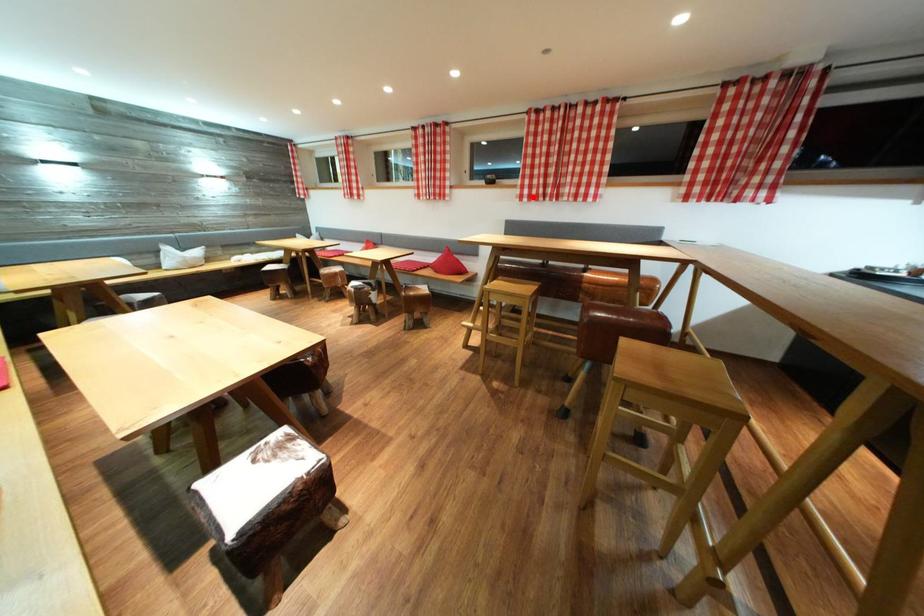
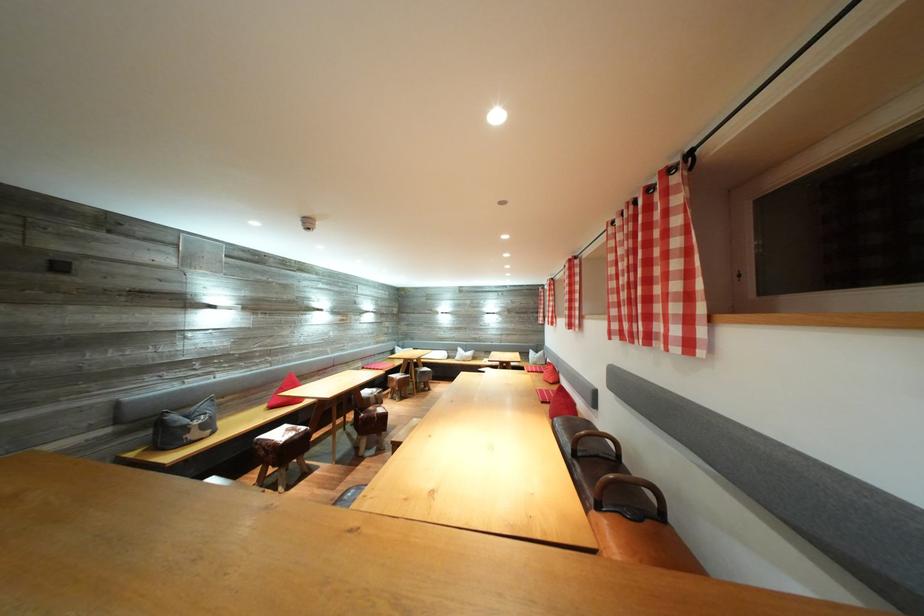
Question: I am providing you with two images of the same scene from different viewpoints. Given a red point in image1, look at the same physical point in image2. Is it:

Choices:
 (A) Closer to the viewpoint
 (B) Farther from the viewpoint

Answer: (B)